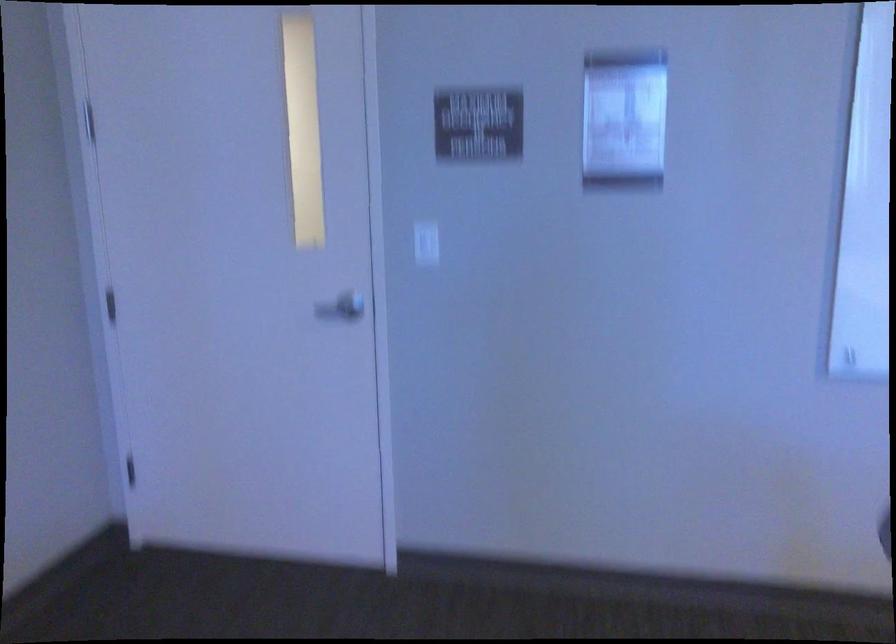
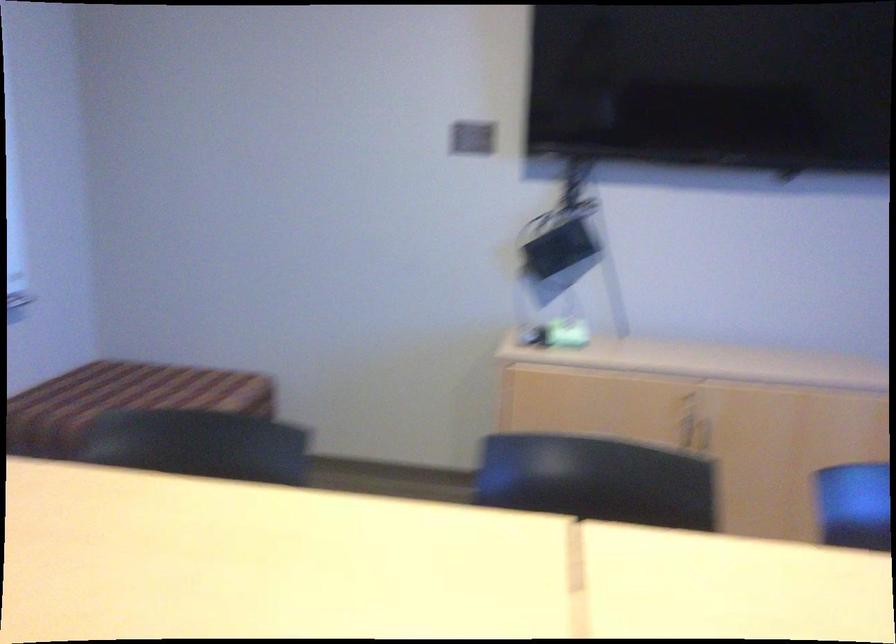
Question: The camera is either moving clockwise (left) or counter-clockwise (right) around the object. The first image is from the beginning of the video and the second image is from the end. Is the camera moving left or right when shooting the video?

Choices:
 (A) Left
 (B) Right

Answer: (A)